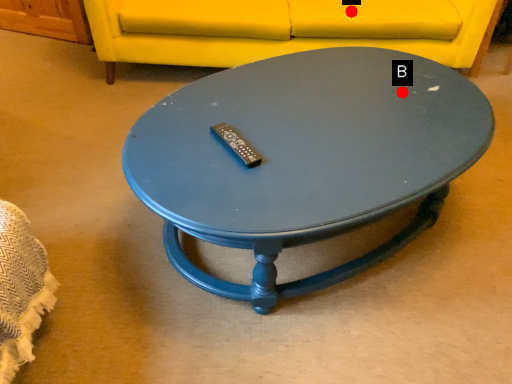
Question: Two points are circled on the image, labeled by A and B beside each circle. Which point is further to the camera?

Choices:
 (A) A is further
 (B) B is further

Answer: (A)